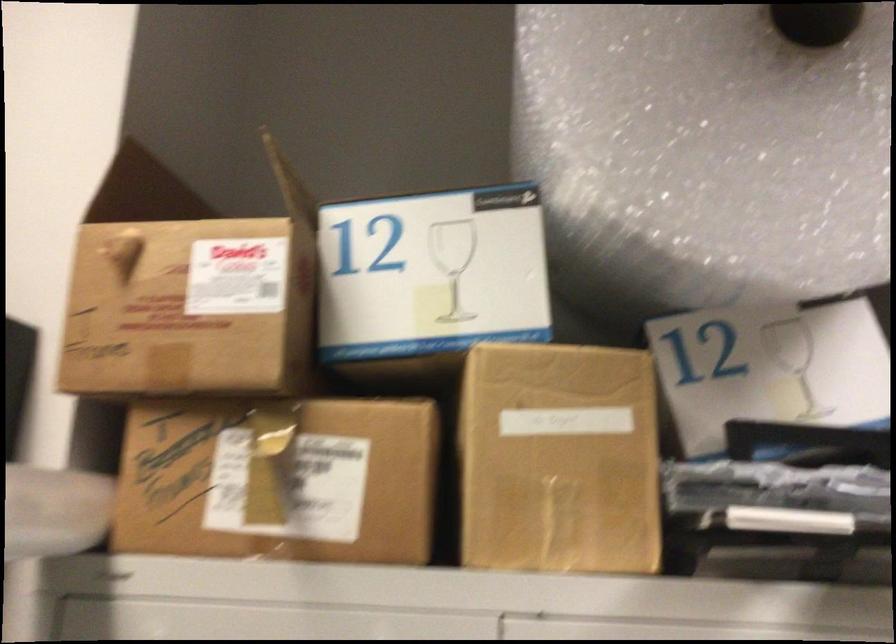
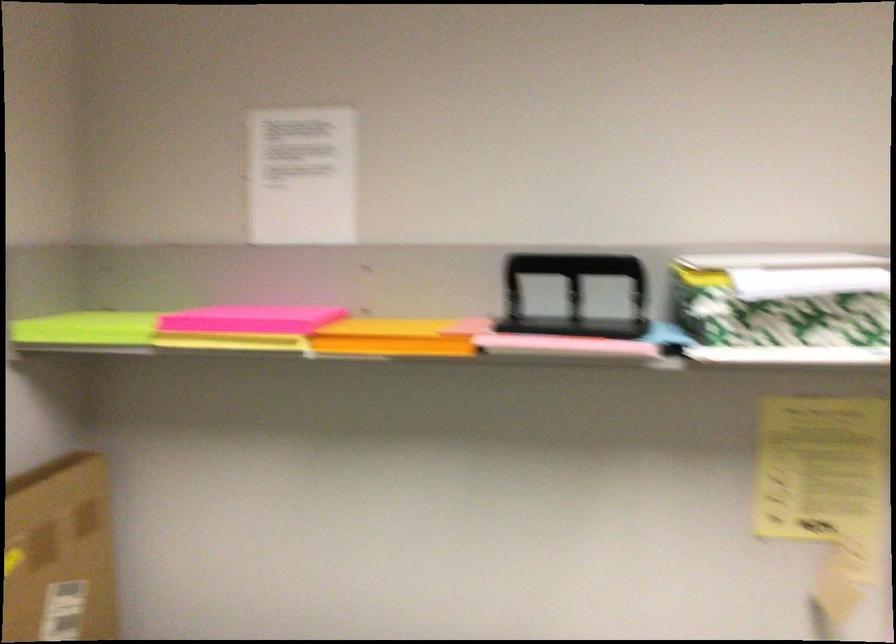
How did the camera likely rotate?

The rotation direction of the camera is right-down.